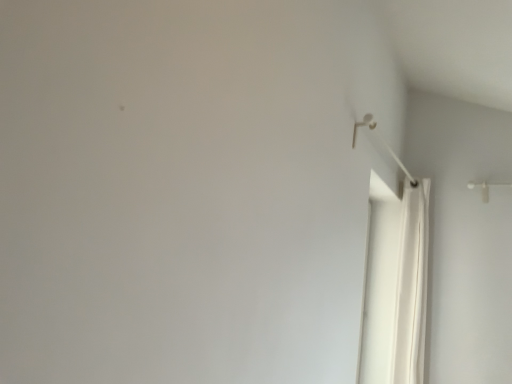
This screenshot has height=384, width=512. Find the location of `white plastic shower at upper right`. white plastic shower at upper right is located at coordinates (362, 125).

What do you see at coordinates (362, 125) in the screenshot? The image size is (512, 384). I see `white plastic shower at upper right` at bounding box center [362, 125].

Describe the element at coordinates (395, 289) in the screenshot. I see `white fabric shower curtain at right` at that location.

The height and width of the screenshot is (384, 512). I want to click on white fabric shower curtain at right, so click(x=395, y=289).

The height and width of the screenshot is (384, 512). In order to click on white plastic shower at upper right in this screenshot , I will do `click(362, 125)`.

Which is more to the left, white fabric shower curtain at right or white plastic shower at upper right?

From the viewer's perspective, white plastic shower at upper right appears more on the left side.

Does white fabric shower curtain at right come behind white plastic shower at upper right?

Yes, it is behind white plastic shower at upper right.

Which is less distant, (x=364, y=380) or (x=357, y=123)?

Clearly, point (x=364, y=380) is more distant from the camera than point (x=357, y=123).

From the image's perspective, who appears lower, white fabric shower curtain at right or white plastic shower at upper right?

From the image's view, white fabric shower curtain at right is below.

From a real-world perspective, which is physically below, white fabric shower curtain at right or white plastic shower at upper right?

In real-world perspective, white fabric shower curtain at right is lower.

Is white fabric shower curtain at right wider or thinner than white plastic shower at upper right?

Clearly, white fabric shower curtain at right has more width compared to white plastic shower at upper right.

Looking at this image, considering the relative sizes of white fabric shower curtain at right and white plastic shower at upper right in the image provided, is white fabric shower curtain at right taller than white plastic shower at upper right?

Yes, white fabric shower curtain at right is taller than white plastic shower at upper right.

Which of these two, white fabric shower curtain at right or white plastic shower at upper right, is bigger?

white fabric shower curtain at right.

Is white fabric shower curtain at right spatially inside white plastic shower at upper right, or outside of it?

white fabric shower curtain at right lies outside white plastic shower at upper right.

Is white fabric shower curtain at right beside white plastic shower at upper right?

No.

Is white fabric shower curtain at right aimed at white plastic shower at upper right?

No, white fabric shower curtain at right does not turn towards white plastic shower at upper right.

How different are the orientations of white fabric shower curtain at right and white plastic shower at upper right in degrees?

There is a 4.39-degree angle between the facing directions of white fabric shower curtain at right and white plastic shower at upper right.

Where is `shower curtain lying on the right of white plastic shower at upper right`? shower curtain lying on the right of white plastic shower at upper right is located at coordinates (395, 289).

Is white plastic shower at upper right to the right of white fabric shower curtain at right from the viewer's perspective?

Incorrect, white plastic shower at upper right is not on the right side of white fabric shower curtain at right.

Which is behind, white plastic shower at upper right or white fabric shower curtain at right?

white fabric shower curtain at right is further from the camera.

Considering the positions of point (408, 175) and point (412, 335), is point (408, 175) closer or farther from the camera than point (412, 335)?

Point (408, 175).

From the image's perspective, who appears lower, white plastic shower at upper right or white fabric shower curtain at right?

white fabric shower curtain at right appears lower in the image.

Consider the image. From a real-world perspective, is white plastic shower at upper right physically located above or below white fabric shower curtain at right?

white plastic shower at upper right is situated higher than white fabric shower curtain at right in the real world.

Which object is thinner, white plastic shower at upper right or white fabric shower curtain at right?

Thinner between the two is white plastic shower at upper right.

Who is taller, white plastic shower at upper right or white fabric shower curtain at right?

white fabric shower curtain at right.

From the picture: Who is bigger, white plastic shower at upper right or white fabric shower curtain at right?

white fabric shower curtain at right is bigger.

Consider the image. Is white fabric shower curtain at right inside white plastic shower at upper right?

No, white fabric shower curtain at right is not a part of white plastic shower at upper right.

Are white plastic shower at upper right and white fabric shower curtain at right making contact?

No, white plastic shower at upper right is not next to white fabric shower curtain at right.

Is white plastic shower at upper right facing away from white fabric shower curtain at right?

No, white plastic shower at upper right is not facing away from white fabric shower curtain at right.

How many degrees apart are the facing directions of white plastic shower at upper right and white fabric shower curtain at right?

There is a 4.39-degree angle between the facing directions of white plastic shower at upper right and white fabric shower curtain at right.

Find the location of `shower above the white fabric shower curtain at right (from a real-world perspective)`. shower above the white fabric shower curtain at right (from a real-world perspective) is located at coordinates tap(362, 125).

This screenshot has width=512, height=384. Find the location of `shower curtain behind the white plastic shower at upper right`. shower curtain behind the white plastic shower at upper right is located at coordinates (395, 289).

In the image, there is a white fabric shower curtain at right. At what (x,y) coordinates should I click in order to perform the action: click on shower above it (from the image's perspective). Please return your answer as a coordinate pair (x, y). The width and height of the screenshot is (512, 384). Looking at the image, I should click on (362, 125).